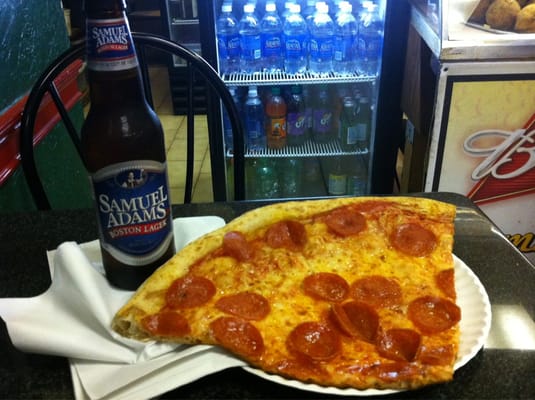
Find the location of a particular element. The height and width of the screenshot is (400, 535). beer bottle is located at coordinates (119, 137).